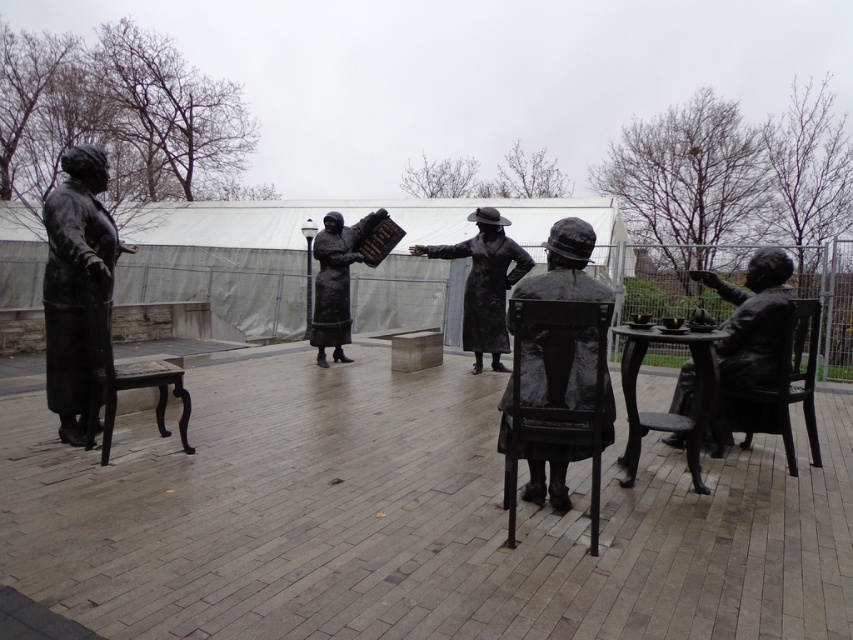
Question: Is bronze statue at left wider than bronze statue at right?

Choices:
 (A) yes
 (B) no

Answer: (B)

Question: Among these objects, which one is farthest from the camera?

Choices:
 (A) black metal chair at center
 (B) bronze statue at right

Answer: (B)

Question: Which point is farther from the camera taking this photo?

Choices:
 (A) (115, 408)
 (B) (126, 248)

Answer: (B)

Question: Is bronze statue at left to the left of bronze statue of woman holding book at center from the viewer's perspective?

Choices:
 (A) no
 (B) yes

Answer: (B)

Question: Which object is farther from the camera taking this photo?

Choices:
 (A) bronze statue at left
 (B) black metal chair at center

Answer: (A)

Question: Can you confirm if bronze statue at right is wider than black polished wood chair at left?

Choices:
 (A) yes
 (B) no

Answer: (A)